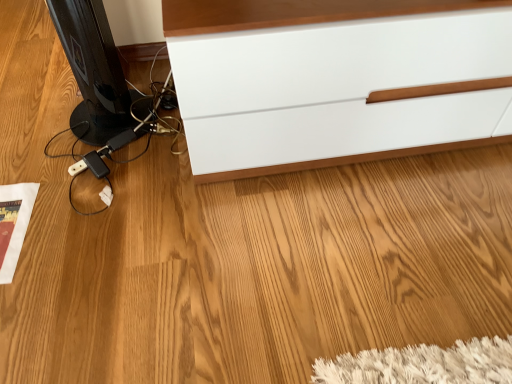
What do you see at coordinates (93, 70) in the screenshot?
I see `black glossy computer monitor at left` at bounding box center [93, 70].

What are the coordinates of `black glossy computer monitor at left` in the screenshot? It's located at pos(93,70).

Identify the location of black glossy computer monitor at left. This screenshot has width=512, height=384. pos(93,70).